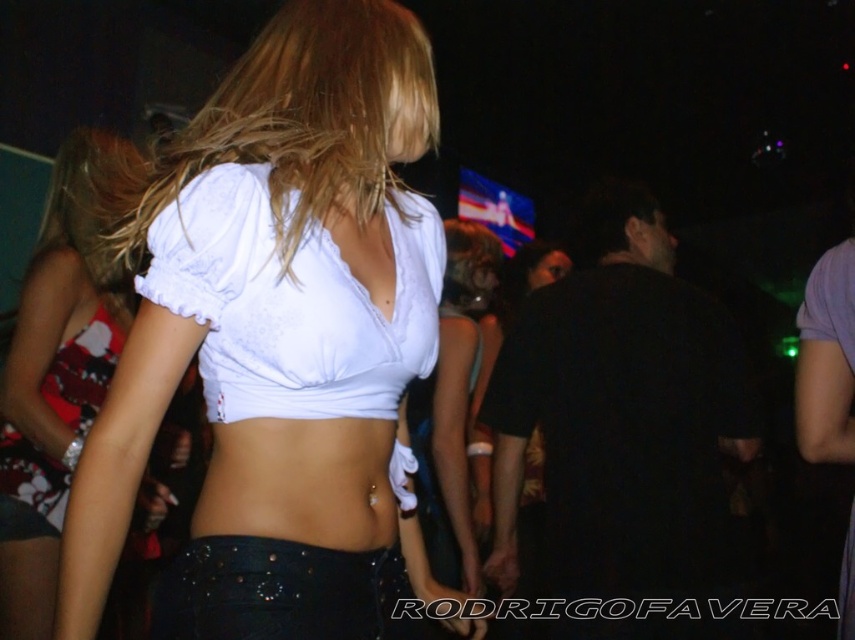
Is white matte fabric top at center positioned before blondehair at center?

Yes, white matte fabric top at center is in front of blondehair at center.

Where is `white matte fabric top at center`? The height and width of the screenshot is (640, 855). white matte fabric top at center is located at coordinates (276, 337).

Where is `white matte fabric top at center`? white matte fabric top at center is located at coordinates (276, 337).

Is blondehair at center above white cotton top at center?

Correct, blondehair at center is located above white cotton top at center.

Can you confirm if blondehair at center is positioned to the right of white cotton top at center?

Indeed, blondehair at center is positioned on the right side of white cotton top at center.

The height and width of the screenshot is (640, 855). What do you see at coordinates (290, 129) in the screenshot? I see `blondehair at center` at bounding box center [290, 129].

Find the location of `blondehair at center`. blondehair at center is located at coordinates (290, 129).

Does point (410, 90) come farther from viewer compared to point (476, 580)?

No, (410, 90) is closer to viewer.

Who is more distant from viewer, (143, 177) or (476, 556)?

Positioned behind is point (476, 556).

Where is `blondehair at center`? The width and height of the screenshot is (855, 640). blondehair at center is located at coordinates (290, 129).